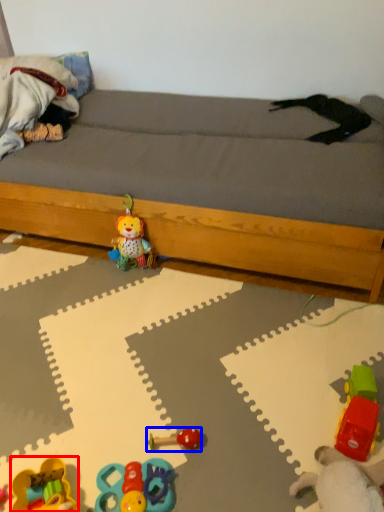
Question: Which point is further to the camera, toy (highlighted by a red box) or toy (highlighted by a blue box)?

Choices:
 (A) toy
 (B) toy

Answer: (B)